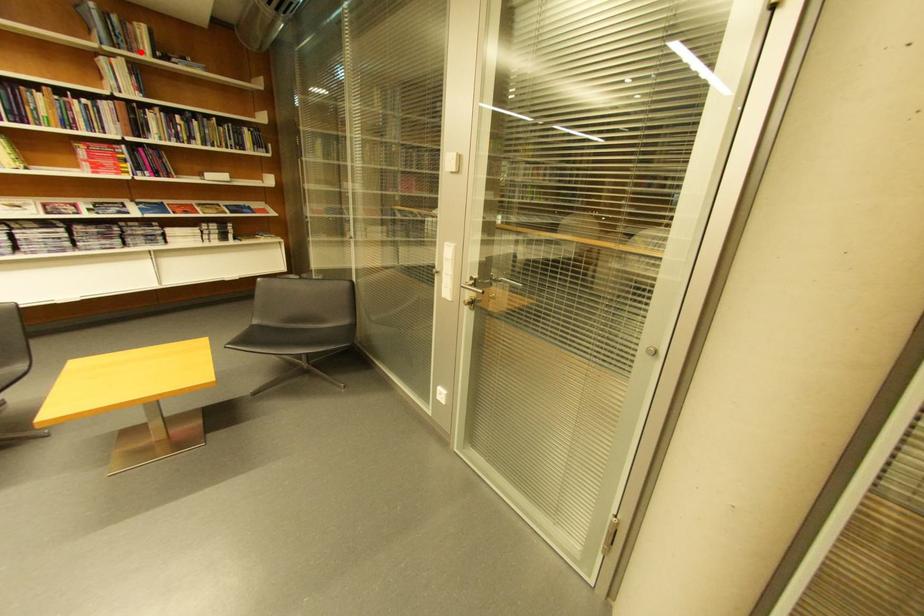
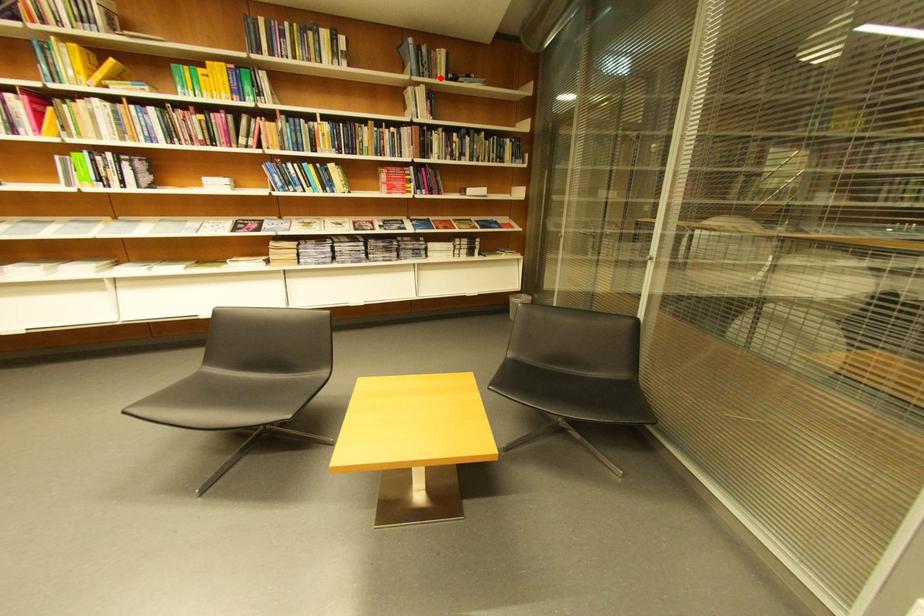
I am providing you with two images of the same scene from different viewpoints. A red point is marked on the first image and another point is marked on the second image. Is the marked point in image1 the same physical position as the marked point in image2?

Yes